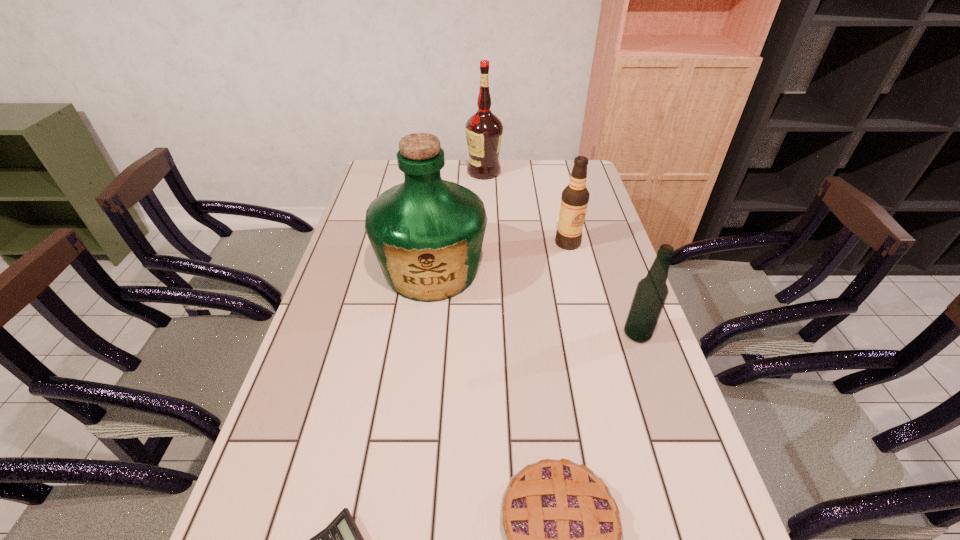
At what (x,y) coordinates should I click in order to perform the action: click on vacant point located on the label of the second farthest alcohol. Please return your answer as a coordinate pair (x, y). Looking at the image, I should click on (577, 279).

I want to click on blank space located on the back of the rightmost alcohol, so click(606, 242).

This screenshot has height=540, width=960. What are the coordinates of `object located in the far edge section of the desktop` in the screenshot? It's located at (484, 130).

Find the location of a particular element. This screenshot has height=540, width=960. object present at the left edge is located at coordinates (427, 233).

The image size is (960, 540). In order to click on free space at the far edge of the desktop in this screenshot , I will do `click(539, 181)`.

Find the location of a particular element. vacant region at the left edge of the desktop is located at coordinates (280, 456).

Locate an element on the screen. This screenshot has height=540, width=960. vacant space at the right edge is located at coordinates (595, 343).

I want to click on free space between the rightmost object and the second farthest alcohol, so click(603, 288).

Locate an element on the screen. Image resolution: width=960 pixels, height=540 pixels. vacant space that is in between the second nearest alcohol and the leftmost alcohol is located at coordinates (526, 207).

Find the location of a particular element. Image resolution: width=960 pixels, height=540 pixels. the closest object to the tallest alcohol is located at coordinates (427, 233).